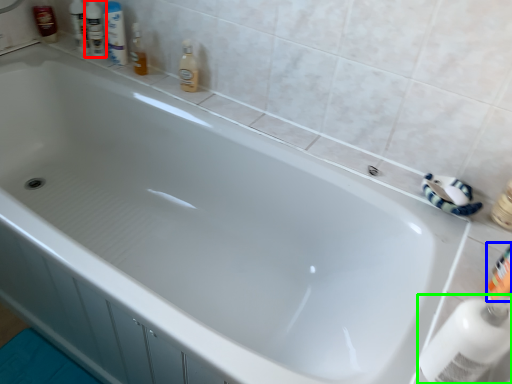
Question: Considering the real-world distances, which object is closest to toiletry (highlighted by a red box)? toiletry (highlighted by a blue box) or cleaning product (highlighted by a green box).

Choices:
 (A) toiletry
 (B) cleaning product

Answer: (A)